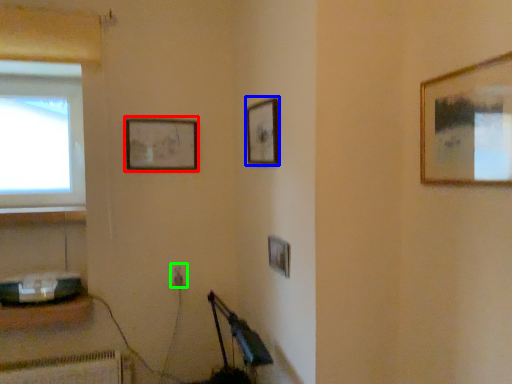
Question: Based on their relative distances, which object is nearer to picture frame (highlighted by a red box)? Choose from picture frame (highlighted by a blue box) and electric outlet (highlighted by a green box).

Choices:
 (A) picture frame
 (B) electric outlet

Answer: (A)